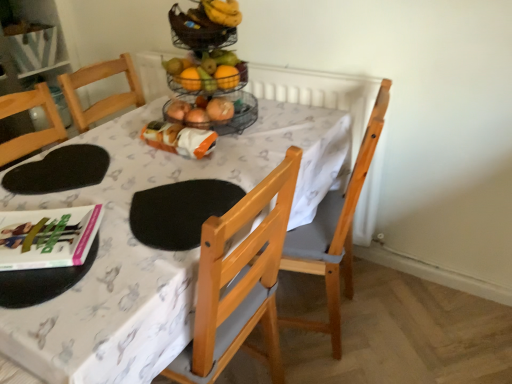
Question: Considering the relative positions of white fabric table at center and light brown wooden chair at center in the image provided, is white fabric table at center to the left of light brown wooden chair at center from the viewer's perspective?

Choices:
 (A) no
 (B) yes

Answer: (B)

Question: Is white fabric table at center positioned beyond the bounds of light brown wooden chair at center?

Choices:
 (A) no
 (B) yes

Answer: (B)

Question: Is white fabric table at center bigger than light brown wooden chair at center?

Choices:
 (A) yes
 (B) no

Answer: (A)

Question: Is white fabric table at center further to the viewer compared to light brown wooden chair at center?

Choices:
 (A) no
 (B) yes

Answer: (A)

Question: Considering the relative positions of white fabric table at center and light brown wooden chair at center in the image provided, is white fabric table at center to the right of light brown wooden chair at center from the viewer's perspective?

Choices:
 (A) yes
 (B) no

Answer: (B)

Question: Can you confirm if white fabric table at center is taller than light brown wooden chair at center?

Choices:
 (A) yes
 (B) no

Answer: (B)

Question: From a real-world perspective, is white fabric table at center physically below hardcover book at lower left?

Choices:
 (A) no
 (B) yes

Answer: (B)

Question: Is white fabric table at center aimed at hardcover book at lower left?

Choices:
 (A) yes
 (B) no

Answer: (B)

Question: Is white fabric table at center smaller than hardcover book at lower left?

Choices:
 (A) yes
 (B) no

Answer: (B)

Question: Is white fabric table at center further to the viewer compared to hardcover book at lower left?

Choices:
 (A) yes
 (B) no

Answer: (B)

Question: Does white fabric table at center have a greater height compared to hardcover book at lower left?

Choices:
 (A) no
 (B) yes

Answer: (B)

Question: Is white fabric table at center outside hardcover book at lower left?

Choices:
 (A) no
 (B) yes

Answer: (B)

Question: Does orange matte grapefruit at upper center have a greater height compared to hardcover book at lower left?

Choices:
 (A) no
 (B) yes

Answer: (B)